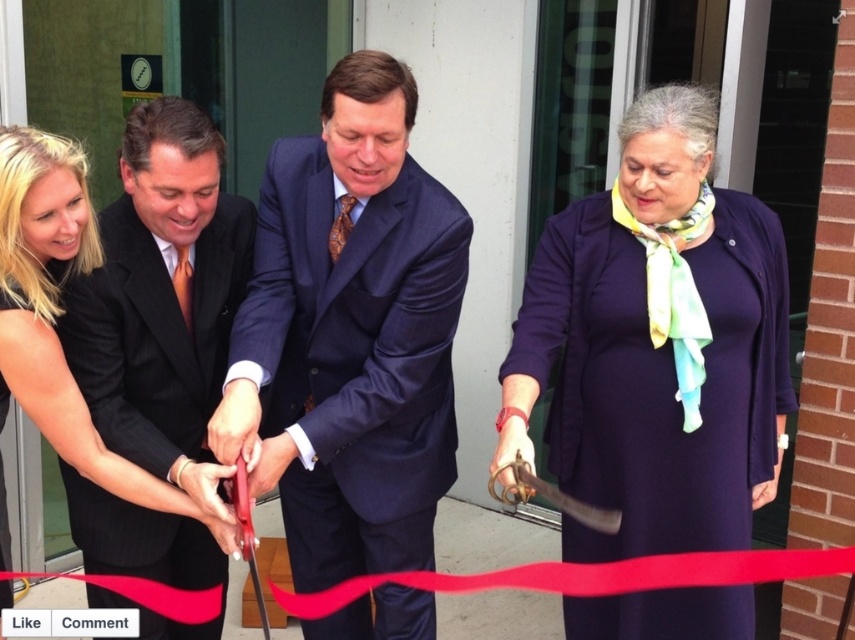
In the scene shown: During the ribbon cutting ceremony, there are two people at the center wearing the shiny blue suit at center and the black silk dress at center. Which one is positioned to the right?

The shiny blue suit at center is to the right of the black silk dress at center.